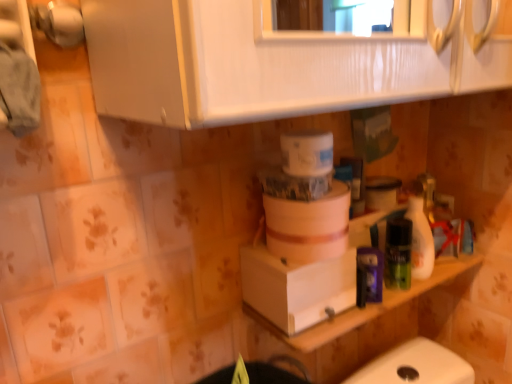
Question: Is white matte counter top at lower right to the left of white glossy bottle at right from the viewer's perspective?

Choices:
 (A) yes
 (B) no

Answer: (A)

Question: Considering the relative positions of white matte counter top at lower right and white glossy bottle at right in the image provided, is white matte counter top at lower right behind white glossy bottle at right?

Choices:
 (A) yes
 (B) no

Answer: (B)

Question: Considering the relative sizes of white matte counter top at lower right and white glossy bottle at right in the image provided, is white matte counter top at lower right thinner than white glossy bottle at right?

Choices:
 (A) no
 (B) yes

Answer: (A)

Question: Considering the relative sizes of white matte counter top at lower right and white glossy bottle at right in the image provided, is white matte counter top at lower right taller than white glossy bottle at right?

Choices:
 (A) no
 (B) yes

Answer: (A)

Question: Are white matte counter top at lower right and white glossy bottle at right far apart?

Choices:
 (A) yes
 (B) no

Answer: (B)

Question: From their relative heights in the image, would you say white matte counter top at lower right is taller or shorter than white cardboard box at center?

Choices:
 (A) tall
 (B) short

Answer: (A)

Question: Is white matte counter top at lower right inside or outside of white cardboard box at center?

Choices:
 (A) inside
 (B) outside

Answer: (B)

Question: Is white matte counter top at lower right bigger or smaller than white cardboard box at center?

Choices:
 (A) small
 (B) big

Answer: (B)

Question: In the image, is white matte counter top at lower right on the left side or the right side of white cardboard box at center?

Choices:
 (A) right
 (B) left

Answer: (A)

Question: Based on their sizes in the image, would you say white matte counter top at lower right is bigger or smaller than white glossy bottle at right?

Choices:
 (A) big
 (B) small

Answer: (A)

Question: From their relative heights in the image, would you say white matte counter top at lower right is taller or shorter than white glossy bottle at right?

Choices:
 (A) short
 (B) tall

Answer: (A)

Question: From a real-world perspective, is white matte counter top at lower right physically located above or below white glossy bottle at right?

Choices:
 (A) above
 (B) below

Answer: (B)

Question: Relative to white glossy bottle at right, is white matte counter top at lower right in front or behind?

Choices:
 (A) behind
 (B) front

Answer: (B)

Question: In terms of height, does white glossy bottle at right look taller or shorter compared to white matte container at center?

Choices:
 (A) tall
 (B) short

Answer: (A)

Question: Would you say white glossy bottle at right is to the left or to the right of white matte container at center in the picture?

Choices:
 (A) left
 (B) right

Answer: (B)